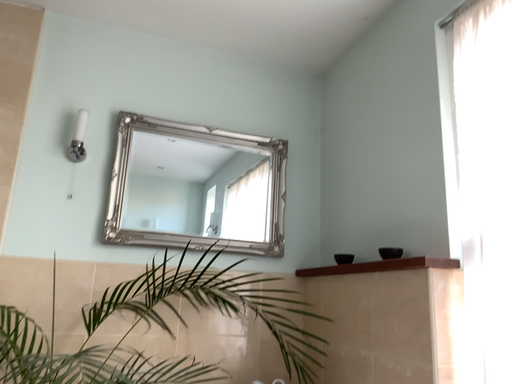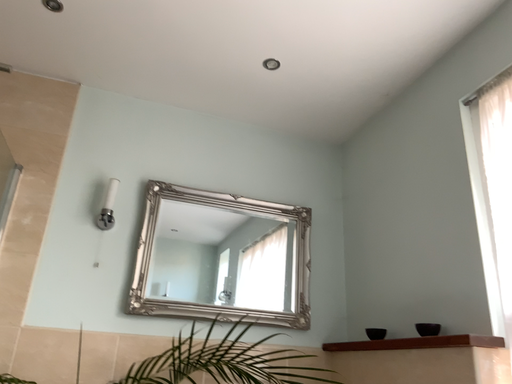
Question: Which way did the camera rotate in the video?

Choices:
 (A) rotated upward
 (B) rotated downward

Answer: (A)